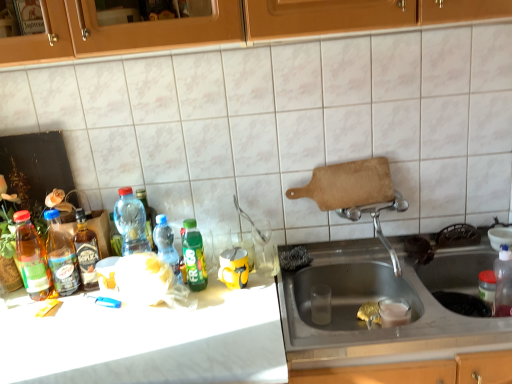
Image resolution: width=512 pixels, height=384 pixels. What are the coordinates of `vacant space in front of translucent plastic bottle at center, positioned as the 3th bottle in right-to-left order` in the screenshot? It's located at (170, 310).